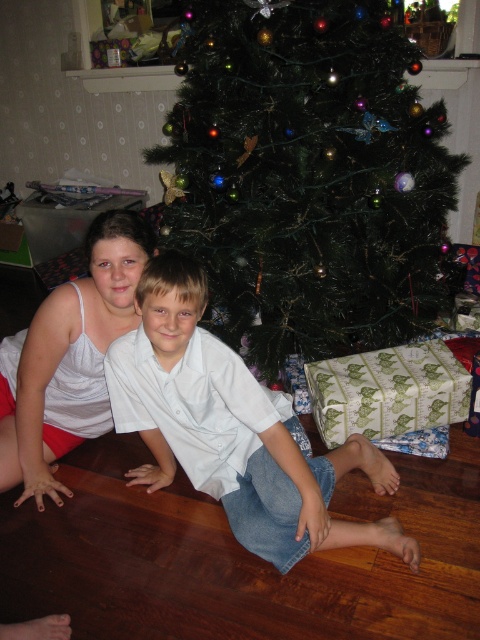
Which is in front, point (322, 353) or point (92, 227)?

Point (92, 227) is in front.

Does green matte christmas tree at center appear on the right side of white cotton tank top at center?

Correct, you'll find green matte christmas tree at center to the right of white cotton tank top at center.

You are a GUI agent. You are given a task and a screenshot of the screen. Output one action in this format:
    pyautogui.click(x=<x>, y=<y>)
    Task: Click on the green matte christmas tree at center
    This screenshot has width=480, height=640.
    Given the screenshot: What is the action you would take?
    pyautogui.click(x=308, y=177)

Does green matte christmas tree at center appear over white cotton shirt at center?

Yes.

Can you confirm if green matte christmas tree at center is thinner than white cotton shirt at center?

No.

Identify the location of green matte christmas tree at center. (308, 177).

Which of these two, green matte christmas tree at center or green striped paper at lower right, stands taller?

green matte christmas tree at center is taller.

Does green matte christmas tree at center have a smaller size compared to green striped paper at lower right?

Incorrect, green matte christmas tree at center is not smaller in size than green striped paper at lower right.

Locate an element on the screen. This screenshot has width=480, height=640. green matte christmas tree at center is located at coordinates (308, 177).